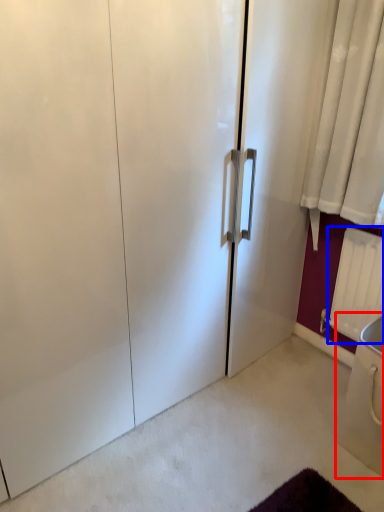
Question: Which object appears farthest to the camera in this image, sink (highlighted by a red box) or radiator (highlighted by a blue box)?

Choices:
 (A) sink
 (B) radiator

Answer: (B)